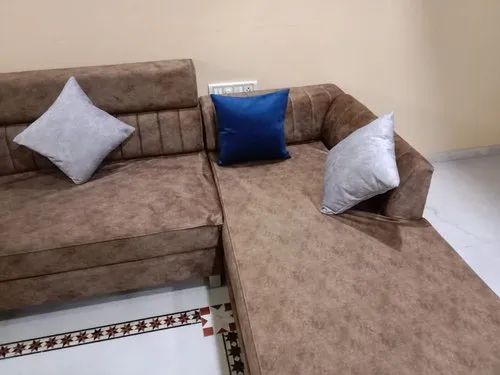
Where is `blue pillow`? The image size is (500, 375). blue pillow is located at coordinates point(262,116).